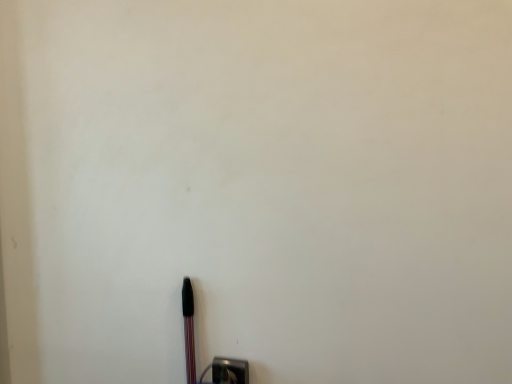
What do you see at coordinates (229, 371) in the screenshot?
I see `black plastic power plug at lower center` at bounding box center [229, 371].

This screenshot has width=512, height=384. I want to click on black plastic power plug at lower center, so click(229, 371).

This screenshot has height=384, width=512. In order to click on black plastic power plug at lower center in this screenshot , I will do `click(229, 371)`.